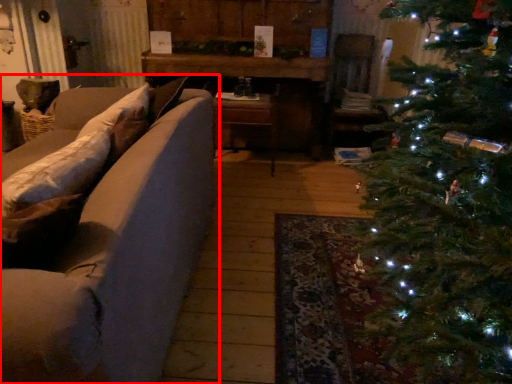
Question: From the image's perspective, what is the correct spatial relationship of studio couch (annotated by the red box) in relation to table?

Choices:
 (A) above
 (B) below

Answer: (B)